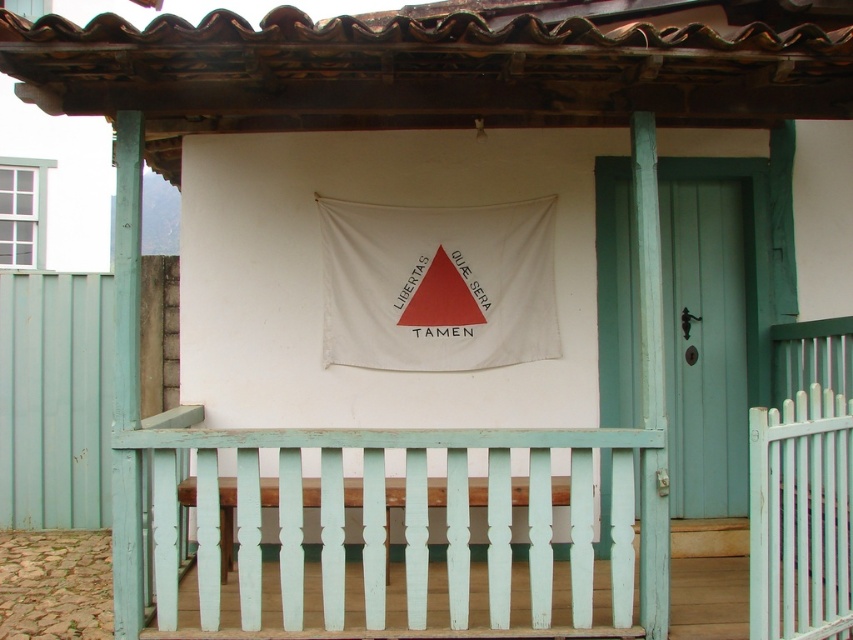
Can you confirm if light teal wood at center is positioned to the left of teal wooden door at center right?

Yes, light teal wood at center is to the left of teal wooden door at center right.

The height and width of the screenshot is (640, 853). Identify the location of light teal wood at center. (410, 532).